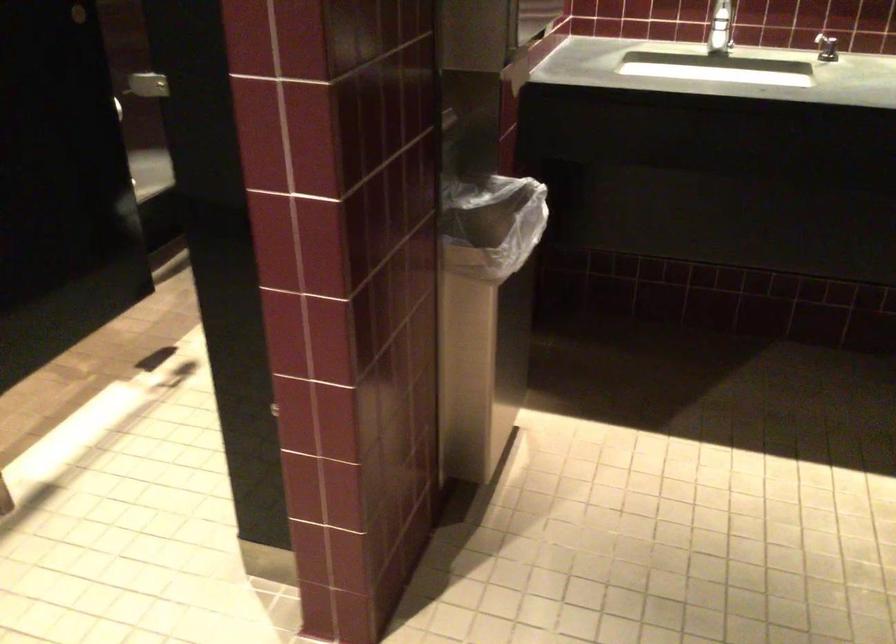
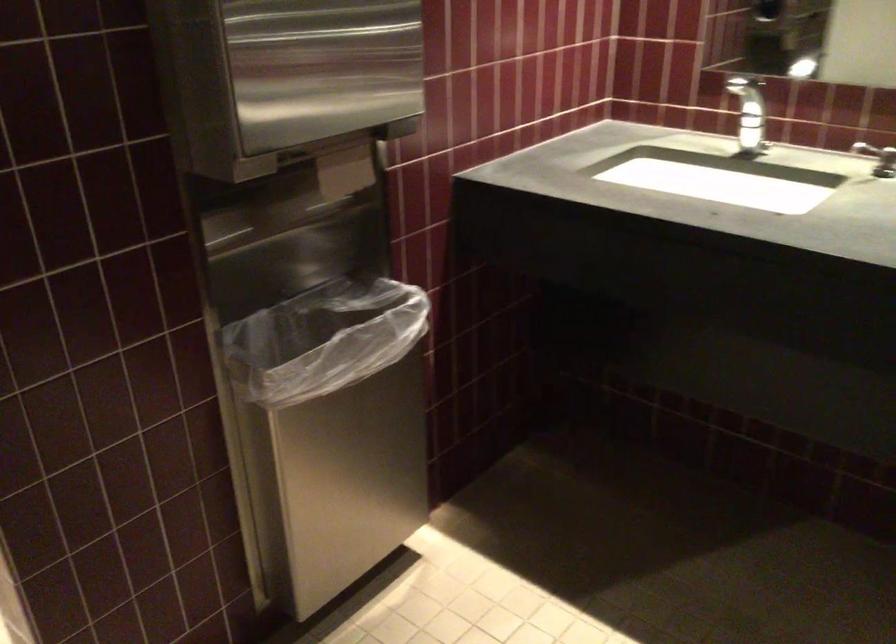
Locate, in the second image, the point that corresponds to the point at 454,212 in the first image.

(326, 315)